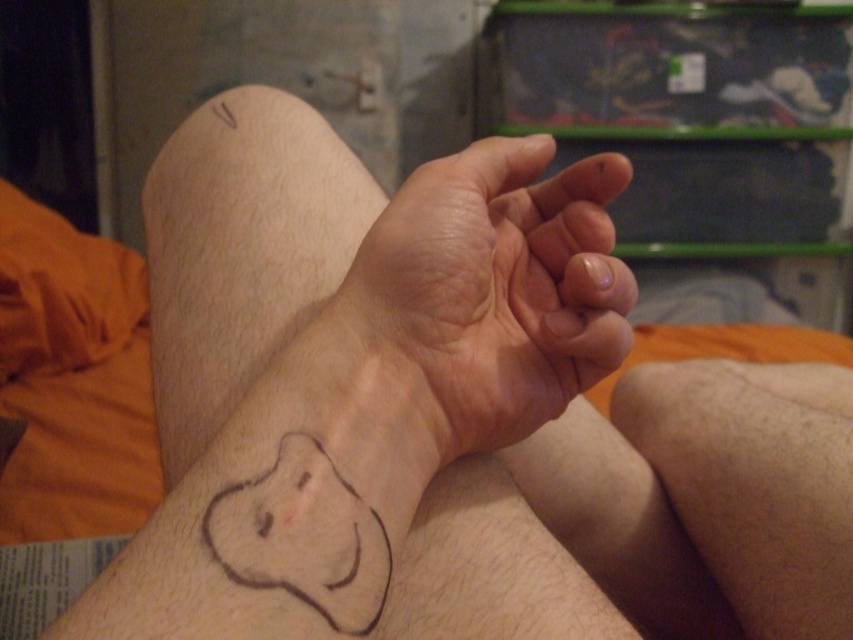
Who is more distant from viewer, (364, 243) or (804, 371)?

Point (804, 371)

The image size is (853, 640). What are the coordinates of `smooth skin at center` in the screenshot? It's located at (480, 301).

Is point (549, 417) closer to camera compared to point (782, 550)?

Yes, point (549, 417) is in front of point (782, 550).

The width and height of the screenshot is (853, 640). What do you see at coordinates (381, 403) in the screenshot? I see `brown ink tattoo at lower left` at bounding box center [381, 403].

Who is more distant from viewer, (601,180) or (844,508)?

Point (844,508)

The image size is (853, 640). Find the location of `brown ink tattoo at lower left`. brown ink tattoo at lower left is located at coordinates (381, 403).

Can you confirm if brown ink tattoo at lower left is positioned to the left of smooth skin at center?

Correct, you'll find brown ink tattoo at lower left to the left of smooth skin at center.

The height and width of the screenshot is (640, 853). Describe the element at coordinates (381, 403) in the screenshot. I see `brown ink tattoo at lower left` at that location.

The image size is (853, 640). Identify the location of brown ink tattoo at lower left. (381, 403).